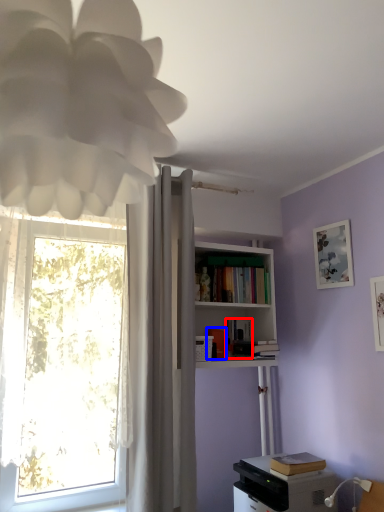
Question: Which point is further to the camera, book (highlighted by a red box) or book (highlighted by a blue box)?

Choices:
 (A) book
 (B) book

Answer: (A)